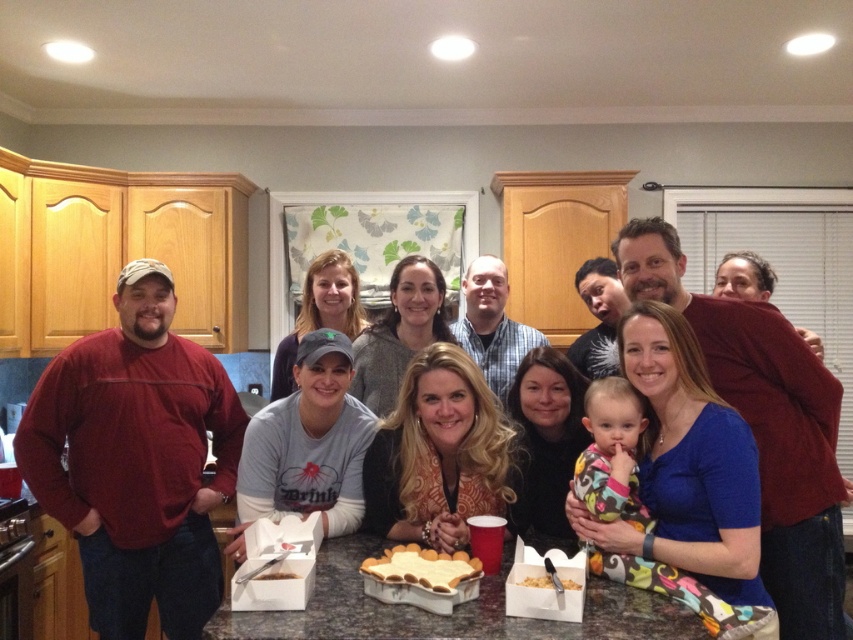
Question: Does red cotton shirt at left appear under white frosted cake at center?

Choices:
 (A) yes
 (B) no

Answer: (B)

Question: Does red cotton shirt at left lie in front of crumbly brown cake at center?

Choices:
 (A) yes
 (B) no

Answer: (B)

Question: Estimate the real-world distances between objects in this image. Which object is closer to the red cotton shirt at left?

Choices:
 (A) matte red shirt at left
 (B) crumbly brown cake at center
 (C) white paper bag at center
 (D) white frosted cake at center

Answer: (B)

Question: Based on their relative distances, which object is nearer to the white frosted cake at center?

Choices:
 (A) matte red shirt at left
 (B) crumbly brown cake at center
 (C) white paper bag at center
 (D) red cotton shirt at left

Answer: (B)

Question: Which point is farther from the camera taking this photo?

Choices:
 (A) (850, 620)
 (B) (256, 579)

Answer: (A)

Question: Can you confirm if red cotton shirt at left is bigger than white frosted cake at center?

Choices:
 (A) yes
 (B) no

Answer: (A)